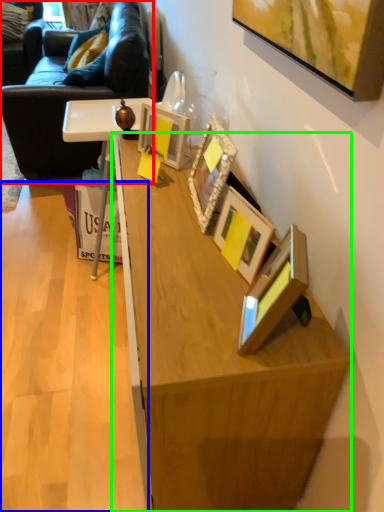
Question: Which object is positioned closest to studio couch (highlighted by a red box)? Select from plywood (highlighted by a blue box) and desk (highlighted by a green box).

Choices:
 (A) plywood
 (B) desk

Answer: (A)